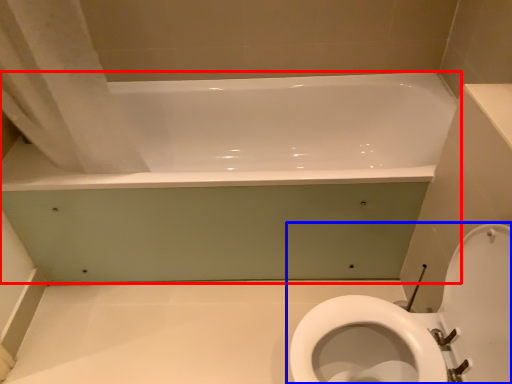
Question: Which of the following is the farthest to the observer, bathtub (highlighted by a red box) or toilet (highlighted by a blue box)?

Choices:
 (A) bathtub
 (B) toilet

Answer: (A)